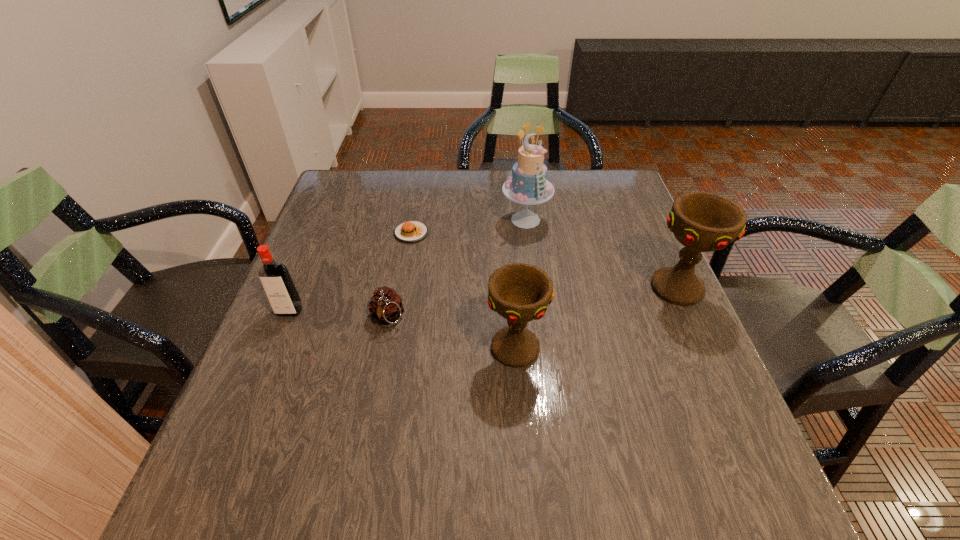
Please point a spot to add another chalice on the left. Please provide its 2D coordinates. Your answer should be formatted as a tuple, i.e. [(x, y)], where the tuple contains the x and y coordinates of a point satisfying the conditions above.

[(306, 426)]